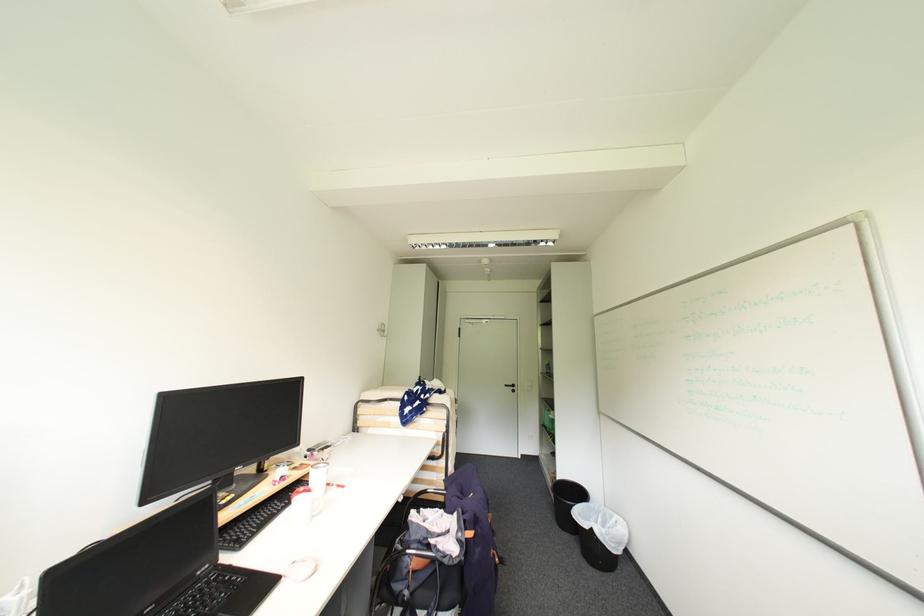
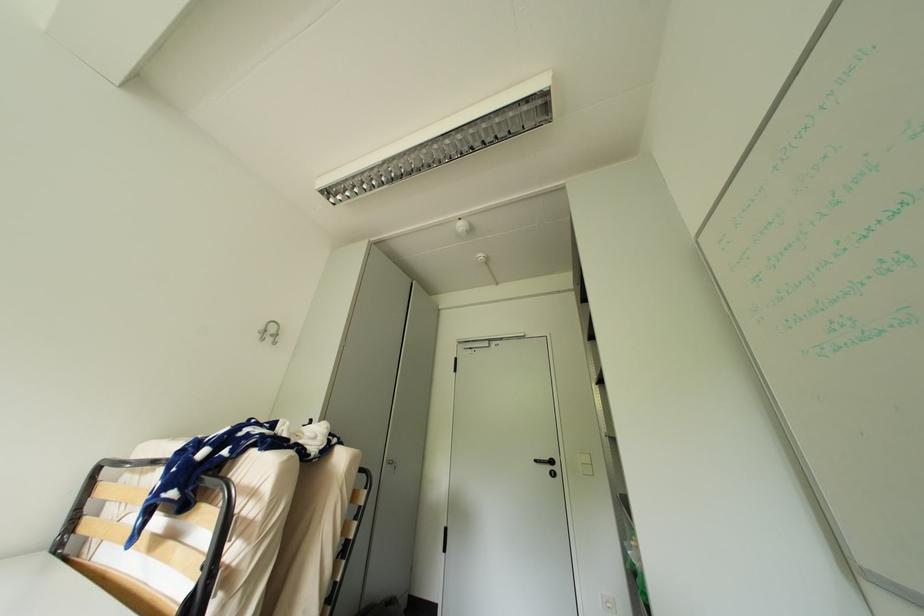
Which direction would the cameraman need to move to produce the second image?

The cameraman walked toward right, forward.